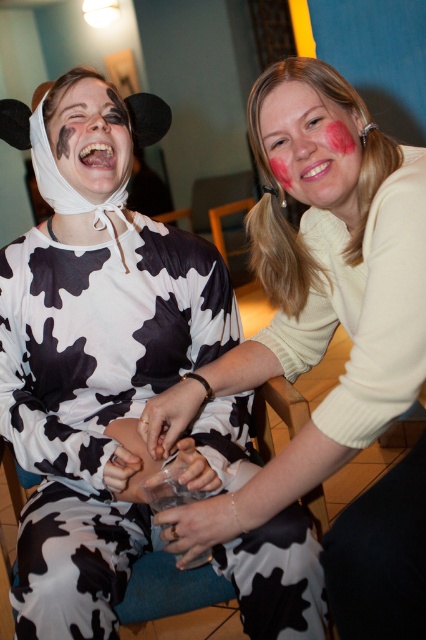
Question: Which is nearer to the black matte paint at upper left?

Choices:
 (A) matte black cow print dress at center
 (B) pink matte face paint at upper center

Answer: (A)

Question: Does pink matte face paint at upper center appear on the right side of black matte paint at upper left?

Choices:
 (A) yes
 (B) no

Answer: (A)

Question: Which point is farther to the camera?

Choices:
 (A) matte black cow print dress at center
 (B) matte white sweater at center
 (C) pink matte face paint at upper center

Answer: (C)

Question: Which of these objects is positioned farthest from the black matte paint at upper left?

Choices:
 (A) matte black cow print dress at center
 (B) matte white sweater at center

Answer: (B)

Question: Does matte black cow print dress at center appear over pink matte face paint at upper center?

Choices:
 (A) no
 (B) yes

Answer: (A)

Question: Is matte white sweater at center smaller than black matte paint at upper left?

Choices:
 (A) no
 (B) yes

Answer: (A)